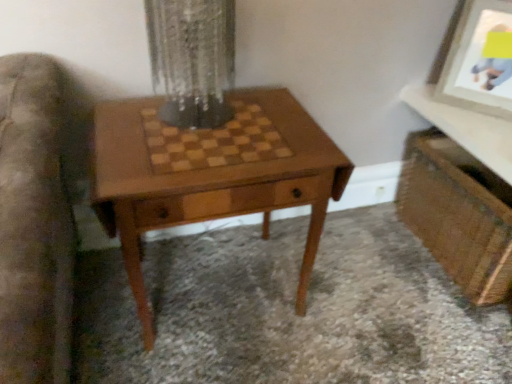
Question: Does wooden vanity at lower right have a lesser width compared to clear glass vase at center?

Choices:
 (A) yes
 (B) no

Answer: (B)

Question: Is clear glass vase at center located within wooden vanity at lower right?

Choices:
 (A) yes
 (B) no

Answer: (B)

Question: Is wooden vanity at lower right not inside clear glass vase at center?

Choices:
 (A) no
 (B) yes

Answer: (B)

Question: Is wooden vanity at lower right wider than clear glass vase at center?

Choices:
 (A) no
 (B) yes

Answer: (B)

Question: Are wooden vanity at lower right and clear glass vase at center located far from each other?

Choices:
 (A) yes
 (B) no

Answer: (B)

Question: Considering the positions of point (415, 155) and point (507, 173), is point (415, 155) closer or farther from the camera than point (507, 173)?

Choices:
 (A) closer
 (B) farther

Answer: (B)

Question: From their relative heights in the image, would you say wooden vanity at lower right is taller or shorter than wooden chessboard at upper right?

Choices:
 (A) tall
 (B) short

Answer: (A)

Question: Based on their sizes in the image, would you say wooden vanity at lower right is bigger or smaller than wooden chessboard at upper right?

Choices:
 (A) small
 (B) big

Answer: (B)

Question: Relative to wooden chessboard at upper right, is wooden vanity at lower right in front or behind?

Choices:
 (A) front
 (B) behind

Answer: (B)

Question: From the image's perspective, relative to clear glass vase at center, is wooden chessboard at upper right above or below?

Choices:
 (A) above
 (B) below

Answer: (B)

Question: Choose the correct answer: Is wooden chessboard at upper right inside clear glass vase at center or outside it?

Choices:
 (A) inside
 (B) outside

Answer: (B)

Question: Looking at their shapes, would you say wooden chessboard at upper right is wider or thinner than clear glass vase at center?

Choices:
 (A) wide
 (B) thin

Answer: (A)

Question: From a real-world perspective, is wooden chessboard at upper right positioned above or below clear glass vase at center?

Choices:
 (A) below
 (B) above

Answer: (A)

Question: From the image's perspective, is clear glass vase at center above or below wooden chessboard at upper right?

Choices:
 (A) above
 (B) below

Answer: (A)

Question: Considering the positions of clear glass vase at center and wooden chessboard at upper right in the image, is clear glass vase at center wider or thinner than wooden chessboard at upper right?

Choices:
 (A) thin
 (B) wide

Answer: (A)